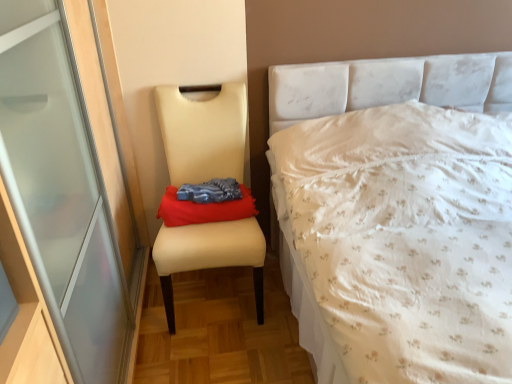
Question: Is red fabric cloth at center not within beige leather chair at left?

Choices:
 (A) yes
 (B) no

Answer: (B)

Question: Is red fabric cloth at center thinner than beige leather chair at left?

Choices:
 (A) yes
 (B) no

Answer: (A)

Question: Does red fabric cloth at center appear on the left side of beige leather chair at left?

Choices:
 (A) yes
 (B) no

Answer: (B)

Question: Does red fabric cloth at center have a smaller size compared to beige leather chair at left?

Choices:
 (A) yes
 (B) no

Answer: (A)

Question: Does red fabric cloth at center appear on the right side of beige leather chair at left?

Choices:
 (A) yes
 (B) no

Answer: (A)

Question: In the image, is white floral fabric bed at right on the left side or the right side of red fabric cloth at center?

Choices:
 (A) right
 (B) left

Answer: (A)

Question: From the image's perspective, relative to red fabric cloth at center, is white floral fabric bed at right above or below?

Choices:
 (A) above
 (B) below

Answer: (B)

Question: Looking at their shapes, would you say white floral fabric bed at right is wider or thinner than red fabric cloth at center?

Choices:
 (A) thin
 (B) wide

Answer: (B)

Question: In the image, is white floral fabric bed at right positioned in front of or behind red fabric cloth at center?

Choices:
 (A) behind
 (B) front

Answer: (B)

Question: Based on their positions, is beige leather chair at left located to the left or right of white floral fabric bed at right?

Choices:
 (A) right
 (B) left

Answer: (B)

Question: Looking at the image, does beige leather chair at left seem bigger or smaller compared to white floral fabric bed at right?

Choices:
 (A) big
 (B) small

Answer: (B)

Question: Is beige leather chair at left situated inside white floral fabric bed at right or outside?

Choices:
 (A) outside
 (B) inside

Answer: (A)

Question: From the image's perspective, is beige leather chair at left above or below white floral fabric bed at right?

Choices:
 (A) above
 (B) below

Answer: (A)

Question: From a real-world perspective, relative to beige leather chair at left, is red fabric cloth at center vertically above or below?

Choices:
 (A) below
 (B) above

Answer: (B)

Question: Is red fabric cloth at center situated inside beige leather chair at left or outside?

Choices:
 (A) outside
 (B) inside

Answer: (B)